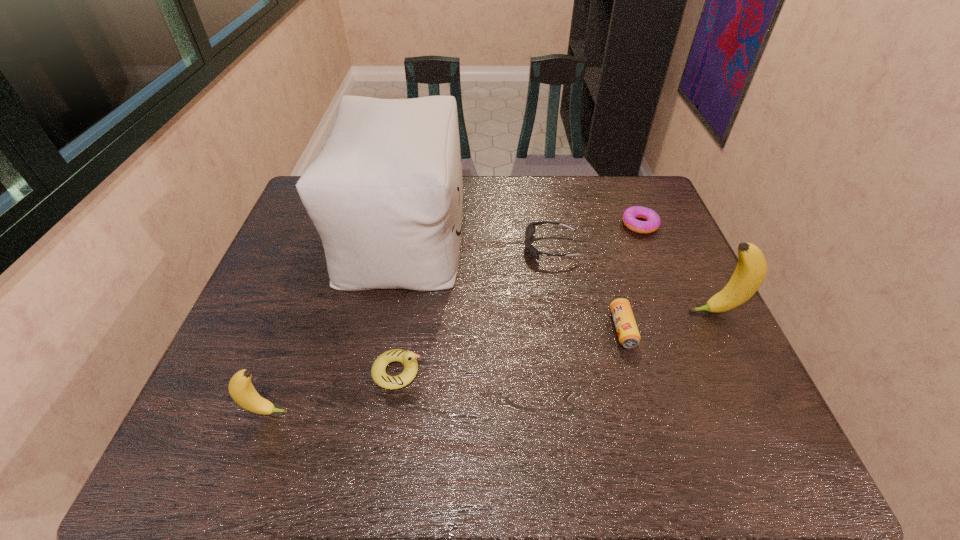
Locate an element on the screen. This screenshot has width=960, height=540. the left banana is located at coordinates (242, 391).

At what (x,y) coordinates should I click in order to perform the action: click on the shorter banana. Please return your answer as a coordinate pair (x, y). The height and width of the screenshot is (540, 960). Looking at the image, I should click on (242, 391).

Identify the location of the farther banana. The width and height of the screenshot is (960, 540). coord(751,270).

The image size is (960, 540). Find the location of `the right banana`. the right banana is located at coordinates (751, 270).

The width and height of the screenshot is (960, 540). Identify the location of cushion. (385, 194).

The width and height of the screenshot is (960, 540). Find the location of `goggles`. goggles is located at coordinates (530, 229).

This screenshot has width=960, height=540. In order to click on the shortest object in this screenshot , I will do `click(652, 223)`.

Locate an element on the screen. Image resolution: width=960 pixels, height=540 pixels. the sixth farthest object is located at coordinates (408, 358).

Find the location of a particular element. duckling is located at coordinates (408, 358).

Find the location of a particular element. the third object from right to left is located at coordinates (627, 331).